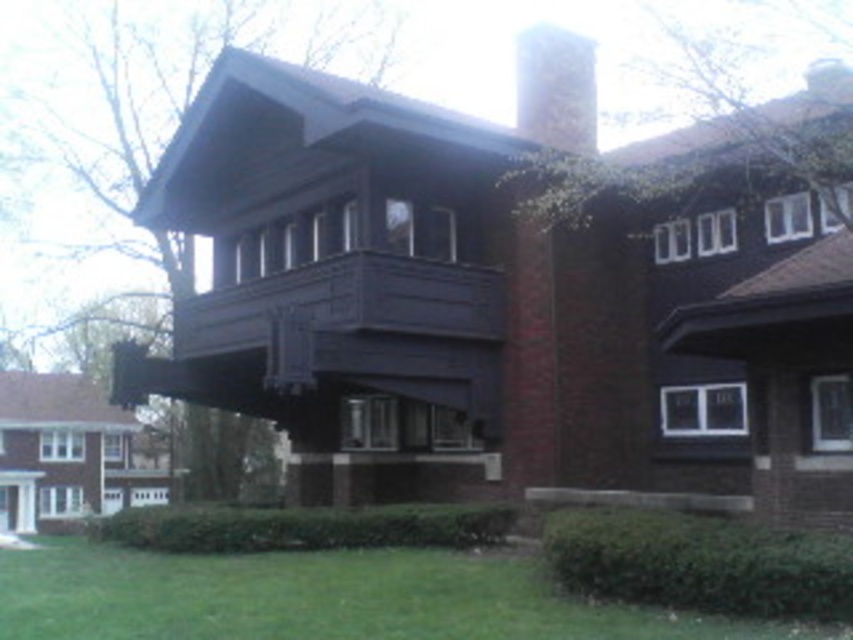
Consider the image. Is the position of green grass at lower center more distant than that of white brick chimney at upper center?

No, it is in front of white brick chimney at upper center.

In the scene shown: Can you confirm if green grass at lower center is thinner than white brick chimney at upper center?

No, green grass at lower center is not thinner than white brick chimney at upper center.

Is point (239, 627) in front of point (566, 92)?

Yes, point (239, 627) is in front of point (566, 92).

Identify the location of green grass at lower center. (328, 596).